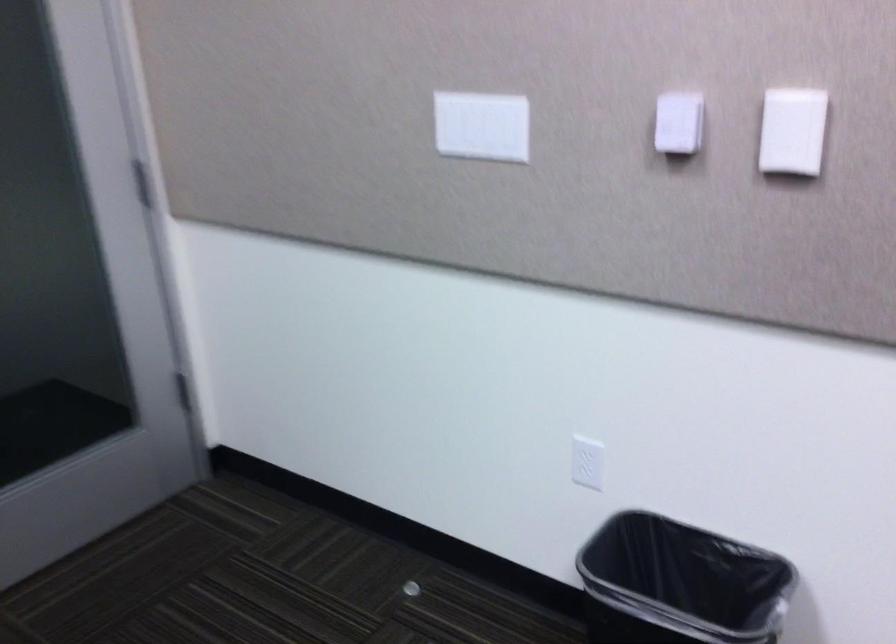
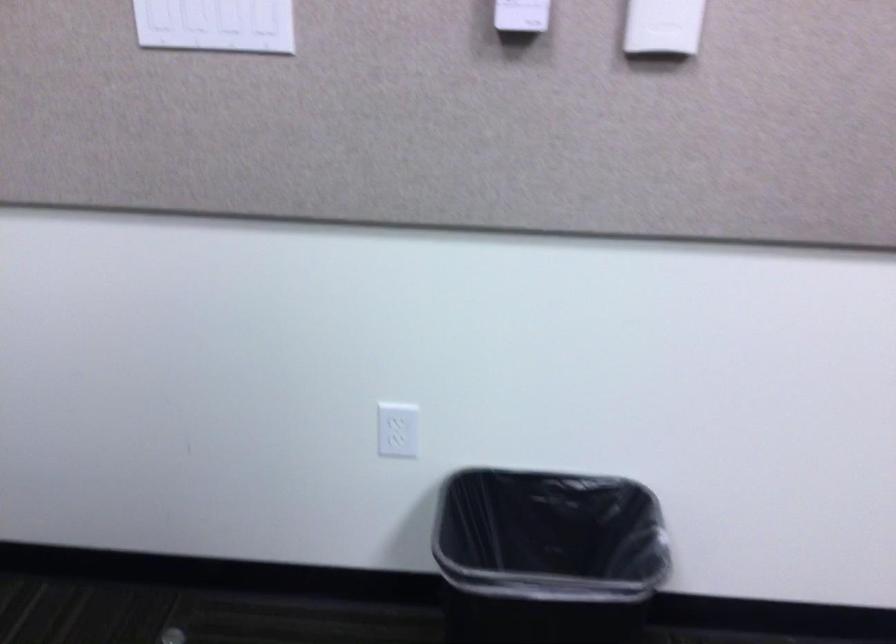
Where in the second image is the point corresponding to point (673, 138) from the first image?

(521, 15)